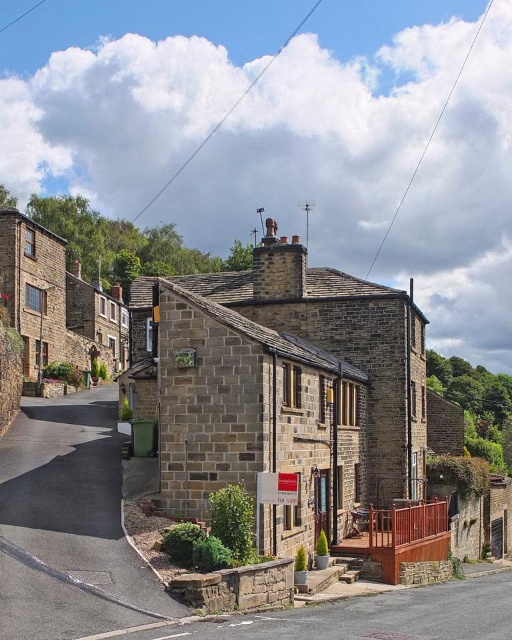
You are a real estate agent preparing a virtual tour of the brown stone house at center and the asphalt road at lower left. You need to ensure the camera focuses on the most prominent object first. Which object should the camera focus on first?

The camera should focus on the brown stone house at center first because it is bigger than the asphalt road at lower left, making it the most prominent object in the scene.

You are standing at the entrance of the brown stone house at center. If you walk straight ahead, will you immediately see the red wooden railing or the chimney stack?

The brown stone house at center is located at point (284, 390). Since the porch with the red wooden railing is in front of the entrance, walking straight ahead would first encounter the red wooden railing before the chimney stack.

You are a delivery driver who needs to park your truck, which is 15 meters long, as close as possible to the brown stone house at center without blocking the asphalt road at lower left. Can you park your truck on the road while keeping the entire truck within 20 meters from the house?

The distance between the brown stone house at center and the asphalt road at lower left is 18.54 meters. Since the truck is 15 meters long and needs to stay within 20 meters of the house, you can park the truck on the road while keeping it entirely within the 20 meter limit. However, ensure that parking does not block the road.